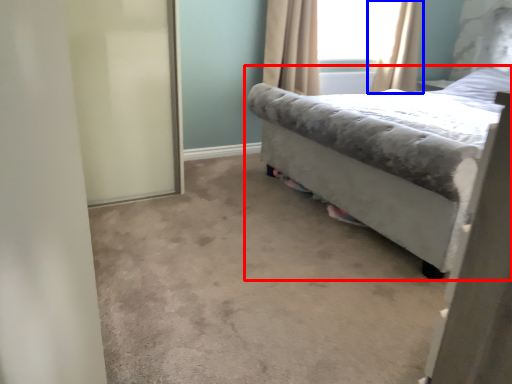
Question: Which point is further to the camera, bed (highlighted by a red box) or curtain (highlighted by a blue box)?

Choices:
 (A) bed
 (B) curtain

Answer: (B)